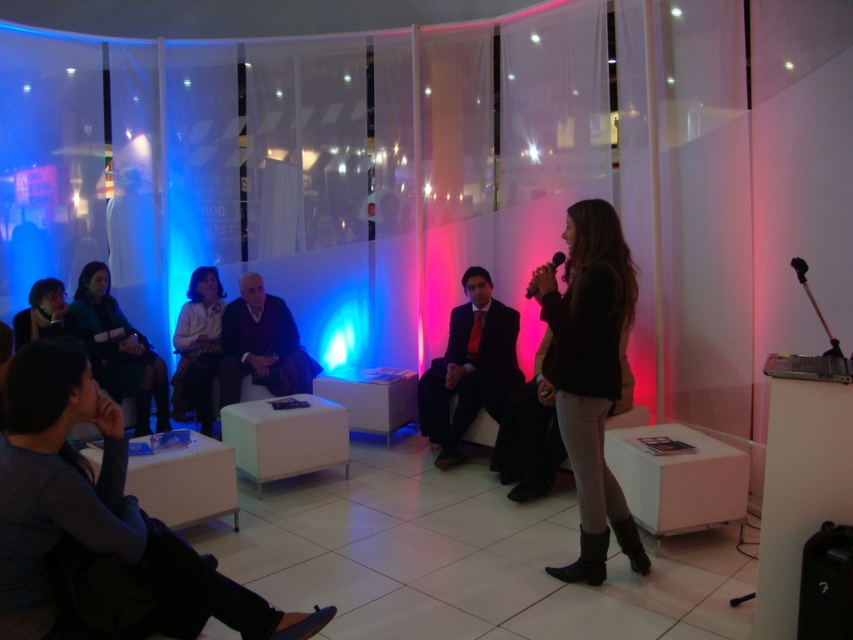
Between point (554, 337) and point (164, 371), which one is positioned in front?

Point (554, 337) is more forward.

Does black leather jacket at center appear over matte green jacket at center?

Yes.

Which is in front, point (613, 262) or point (160, 401)?

Point (613, 262) is more forward.

Locate an element on the screen. This screenshot has width=853, height=640. black leather jacket at center is located at coordinates (590, 376).

Is black leather jacket at center to the right of white knit sweater at center from the viewer's perspective?

Correct, you'll find black leather jacket at center to the right of white knit sweater at center.

Which is more to the right, black leather jacket at center or white knit sweater at center?

black leather jacket at center

Describe the element at coordinates (590, 376) in the screenshot. Image resolution: width=853 pixels, height=640 pixels. I see `black leather jacket at center` at that location.

Find the location of a particular element. The width and height of the screenshot is (853, 640). black leather jacket at center is located at coordinates (590, 376).

Between matte green jacket at center and white knit sweater at center, which one appears on the right side from the viewer's perspective?

From the viewer's perspective, white knit sweater at center appears more on the right side.

Is matte green jacket at center shorter than white knit sweater at center?

In fact, matte green jacket at center may be taller than white knit sweater at center.

Which is behind, point (93, 282) or point (198, 417)?

Point (198, 417)

The height and width of the screenshot is (640, 853). Find the location of `matte green jacket at center`. matte green jacket at center is located at coordinates (119, 348).